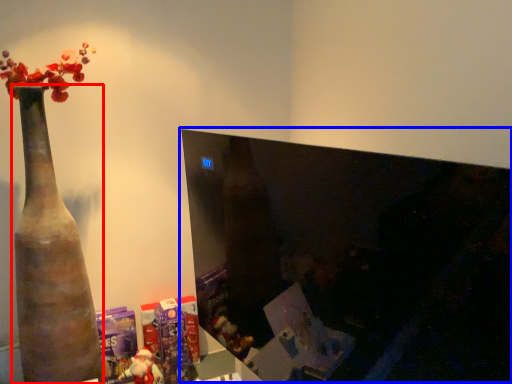
Question: Which object is closer to the camera taking this photo, vase (highlighted by a red box) or computer monitor (highlighted by a blue box)?

Choices:
 (A) vase
 (B) computer monitor

Answer: (B)